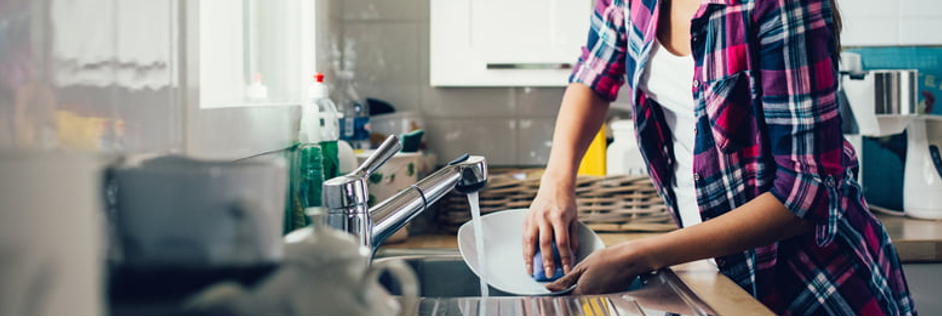
You are a GUI agent. You are given a task and a screenshot of the screen. Output one action in this format:
    pyautogui.click(x=<x>, y=<y>)
    Task: Click on the sponge
    
    Given the screenshot: What is the action you would take?
    pyautogui.click(x=538, y=272)